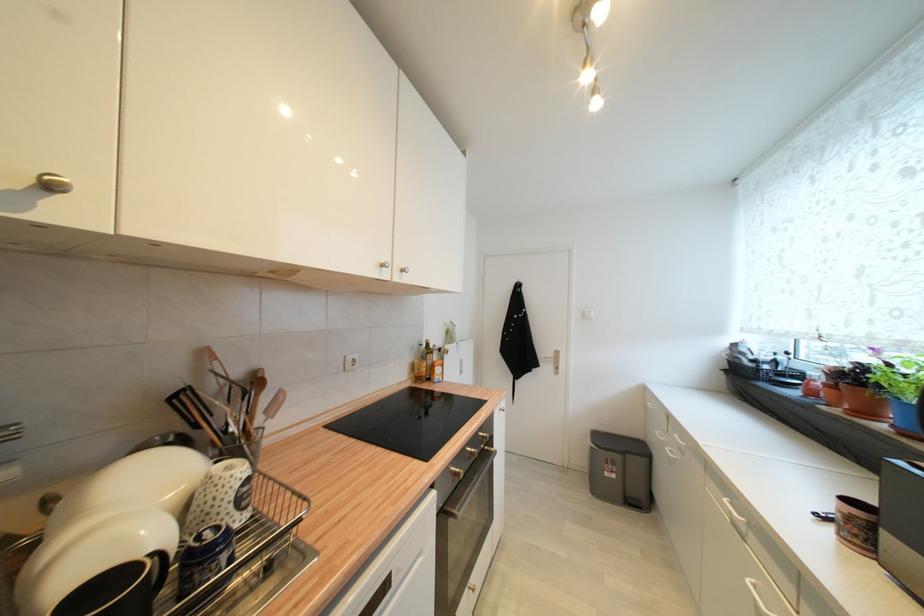
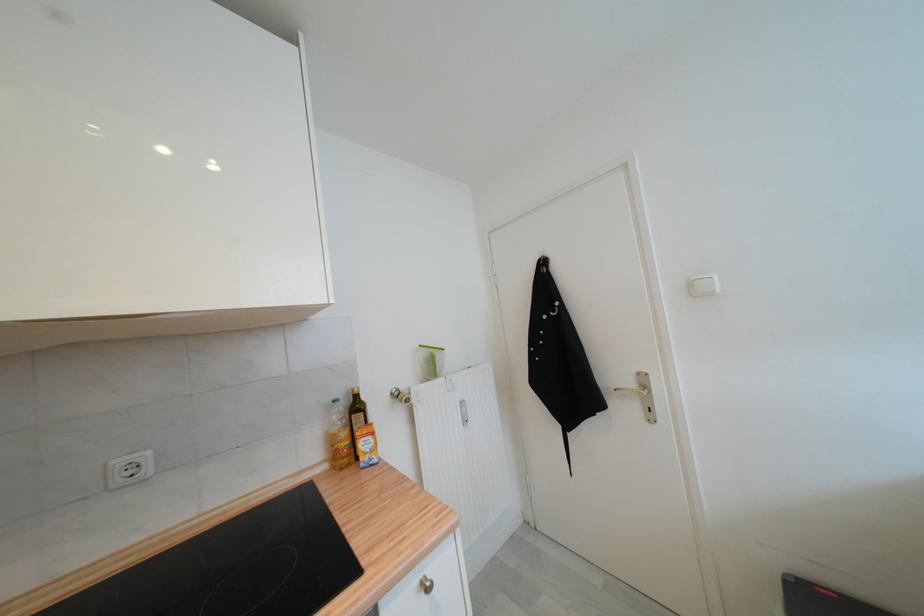
In the second image, find the point that corresponds to point (426, 347) in the first image.

(339, 403)